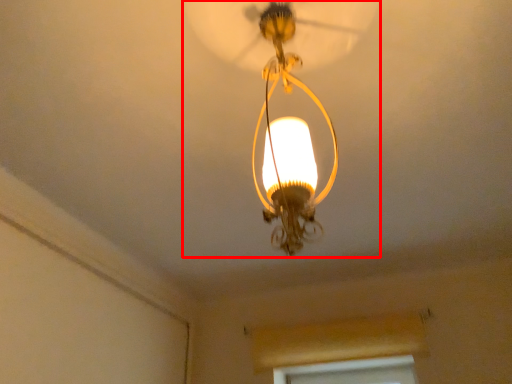
Question: From the image's perspective, what is the correct spatial positioning of lamp (annotated by the red box) in reference to window frame?

Choices:
 (A) below
 (B) above

Answer: (B)